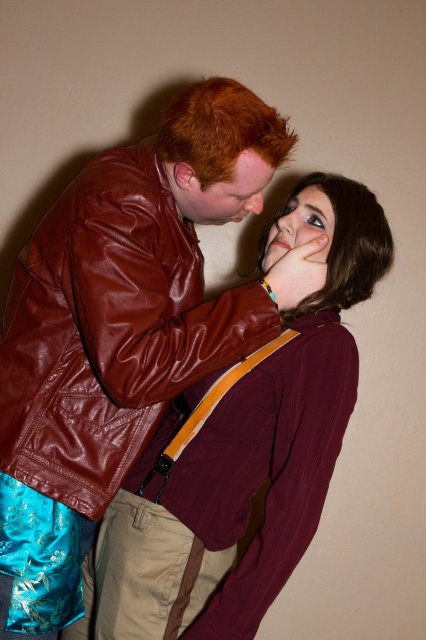
You are a photographer trying to capture the scene. You need to adjust your camera focus to ensure both the shiny brown leather jacket at upper left and the smooth brown hair at upper center are in focus. Which object should you focus on first to ensure depth of field covers both?

The shiny brown leather jacket at upper left is below the smooth brown hair at upper center. To ensure both are in focus, focus on the smooth brown hair at upper center first since it is farther away, allowing the depth of field to extend backward to the jacket closer to the camera.

You are standing in front of a wall and see two people. The first person is wearing a shiny dark red leather jacket over a blue floral garment with short spiky red hair. The second person has shoulder length dark brown hair and is wearing a maroon long sleeved top with orange suspenders. There is a point at coordinates (109, 330). What is located at that point?

At point (109, 330) is the shiny brown leather jacket at upper left.

You are standing in front of the two people in the image. You need to place a small sticker on the point that is closer to you. Which point should you choose between point (x=106, y=188) and point (x=187, y=157)?

Point (x=106, y=188) is in front of point (x=187, y=157), so you should choose point (x=106, y=188) to place the sticker closer to you.